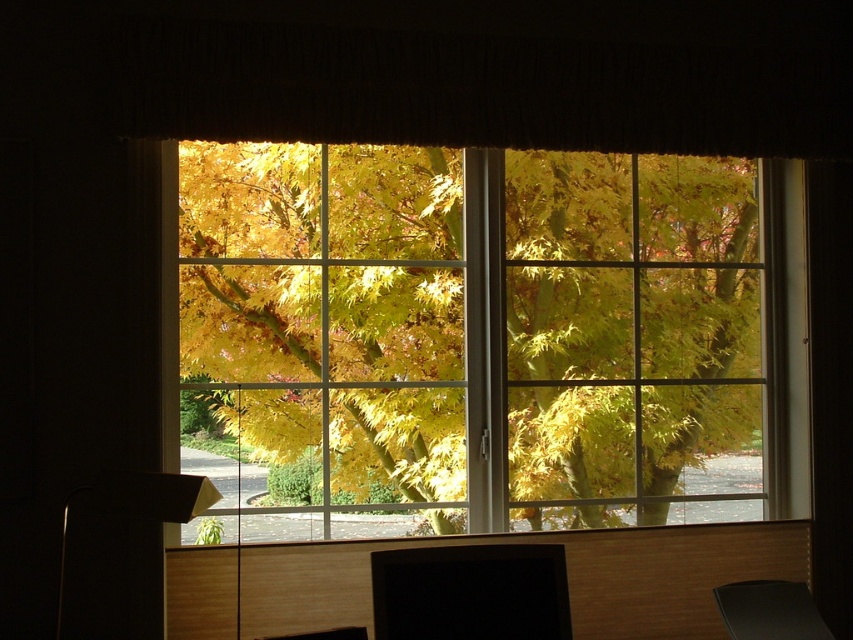
Between point (537, 380) and point (399, 636), which one is positioned in front?

Positioned in front is point (399, 636).

Which is below, yellow/golden leaves at center or black glossy monitor at lower center?

black glossy monitor at lower center is lower down.

Where is `yellow/golden leaves at center`? The height and width of the screenshot is (640, 853). yellow/golden leaves at center is located at coordinates (329, 330).

Is yellow/golden leaves at center above black plastic lamp at lower left?

Yes.

Is yellow/golden leaves at center shorter than black plastic lamp at lower left?

Incorrect, yellow/golden leaves at center's height does not fall short of black plastic lamp at lower left's.

Is point (679, 252) closer to viewer compared to point (132, 497)?

That is False.

At what (x,y) coordinates should I click in order to perform the action: click on yellow/golden leaves at center. Please return your answer as a coordinate pair (x, y). Looking at the image, I should click on (329, 330).

Measure the distance between black plastic lamp at lower left and black glossy monitor at lower center.

The distance of black plastic lamp at lower left from black glossy monitor at lower center is 22.36 inches.

Does black plastic lamp at lower left come in front of black glossy monitor at lower center?

Yes, black plastic lamp at lower left is closer to the viewer.

Between point (119, 499) and point (496, 586), which one is positioned behind?

The point (496, 586) is behind.

The image size is (853, 640). What are the coordinates of `black plastic lamp at lower left` in the screenshot? It's located at (120, 552).